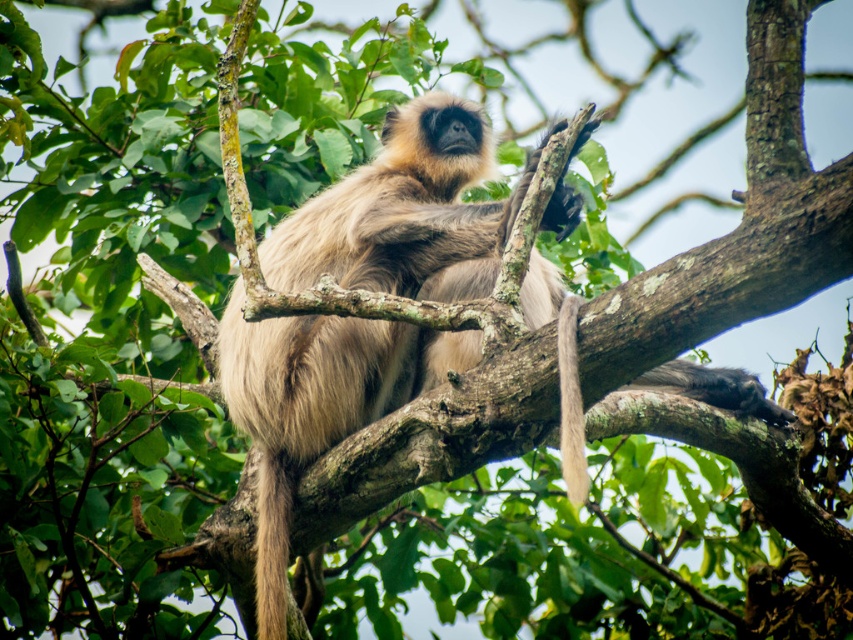
Question: Which of the following is the farthest from the observer?

Choices:
 (A) fuzzy brown tail at lower left
 (B) light brown fur monkey at center

Answer: (A)

Question: Can you confirm if light brown fur monkey at center is positioned to the right of fuzzy brown tail at lower left?

Choices:
 (A) no
 (B) yes

Answer: (B)

Question: Where is fuzzy brown tail at lower left located in relation to fuzzy beige tail at center in the image?

Choices:
 (A) right
 (B) left

Answer: (B)

Question: Which point appears closest to the camera in this image?

Choices:
 (A) (374, 273)
 (B) (573, 483)

Answer: (B)

Question: Among these objects, which one is nearest to the camera?

Choices:
 (A) fuzzy beige tail at center
 (B) light brown fur monkey at center
 (C) fuzzy brown tail at lower left

Answer: (A)

Question: Does fuzzy brown tail at lower left appear over fuzzy beige tail at center?

Choices:
 (A) yes
 (B) no

Answer: (B)